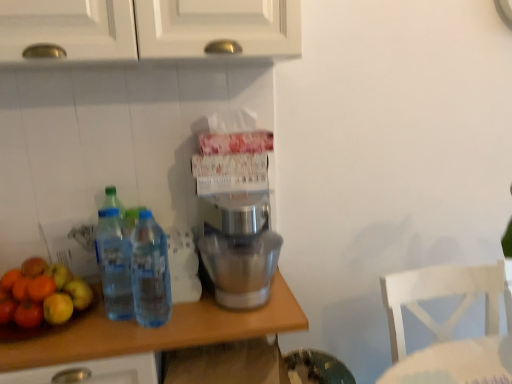
I want to click on white wooden chair at lower right, so click(x=443, y=296).

From a real-world perspective, which object stands above the other?

From a 3D spatial view, transparent plastic bottles at left, the second bottle viewed from the right, is above.

From the picture: Are satin silver mixer at center and transparent plastic bottles at left, the first bottle viewed from the left, far apart?

satin silver mixer at center is actually quite close to transparent plastic bottles at left, the first bottle viewed from the left.

Considering the sizes of objects satin silver mixer at center and transparent plastic bottles at left, the first bottle viewed from the left, in the image provided, who is bigger, satin silver mixer at center or transparent plastic bottles at left, the first bottle viewed from the left,?

satin silver mixer at center is bigger.

Find the location of a particular element. The width and height of the screenshot is (512, 384). the 2nd bottle counting from the left of the satin silver mixer at center is located at coordinates (114, 265).

Is point (73, 301) in front of point (503, 260)?

Yes, it is in front of point (503, 260).

From a real-world perspective, is shiny green apple at left physically located above or below white wooden chair at lower right?

In terms of real-world spatial position, shiny green apple at left is above white wooden chair at lower right.

Locate an element on the screen. Image resolution: width=512 pixels, height=384 pixels. apple behind the white wooden chair at lower right is located at coordinates (41, 294).

Is white wooden chair at lower right surrounded by shiny green apple at left?

Definitely not — white wooden chair at lower right is not inside shiny green apple at left.

Considering the positions of objects clear plastic bottles at center, the first bottle in the right-to-left sequence, and clear wood countertop at center in the image provided, who is more to the right, clear plastic bottles at center, the first bottle in the right-to-left sequence, or clear wood countertop at center?

From the viewer's perspective, clear plastic bottles at center, the first bottle in the right-to-left sequence, appears more on the right side.

From a real-world perspective, is clear plastic bottles at center, arranged as the 2th bottle when viewed from the left, below clear wood countertop at center?

No, from a real-world perspective, clear plastic bottles at center, arranged as the 2th bottle when viewed from the left, is not under clear wood countertop at center.

Is clear wood countertop at center a part of clear plastic bottles at center, the first bottle in the right-to-left sequence?

No, clear plastic bottles at center, the first bottle in the right-to-left sequence, does not contain clear wood countertop at center.

Are clear plastic bottles at center, arranged as the 2th bottle when viewed from the left, and clear wood countertop at center making contact?

No, clear plastic bottles at center, arranged as the 2th bottle when viewed from the left, is not next to clear wood countertop at center.

Which object is positioned more to the left, white wooden chair at lower right or satin silver mixer at center?

From the viewer's perspective, satin silver mixer at center appears more on the left side.

Can you confirm if white wooden chair at lower right is wider than satin silver mixer at center?

Indeed, white wooden chair at lower right has a greater width compared to satin silver mixer at center.

Looking at this image, considering the sizes of objects white wooden chair at lower right and satin silver mixer at center in the image provided, who is taller, white wooden chair at lower right or satin silver mixer at center?

Standing taller between the two is white wooden chair at lower right.

From a real-world perspective, between white wooden chair at lower right and satin silver mixer at center, who is vertically higher?

From a 3D spatial view, satin silver mixer at center is above.

Which of these two, satin silver mixer at center or shiny green apple at left, is bigger?

With larger size is satin silver mixer at center.

How much distance is there between satin silver mixer at center and shiny green apple at left?

satin silver mixer at center is 19.06 inches away from shiny green apple at left.

From the image's perspective, which object appears higher, satin silver mixer at center or shiny green apple at left?

satin silver mixer at center is shown above in the image.

Relative to shiny green apple at left, is satin silver mixer at center in front or behind?

Visually, satin silver mixer at center is located behind shiny green apple at left.

How much distance is there between shiny green apple at left and clear wood countertop at center?

The distance of shiny green apple at left from clear wood countertop at center is 19.70 centimeters.

Does shiny green apple at left have a lesser height compared to clear wood countertop at center?

Yes.

Considering the points (15, 316) and (95, 344), which point is behind, point (15, 316) or point (95, 344)?

Point (15, 316)

Is point (152, 219) closer or farther from the camera than point (206, 250)?

Clearly, point (152, 219) is more distant from the camera than point (206, 250).

Considering the positions of objects clear plastic bottles at center, arranged as the 2th bottle when viewed from the left, and satin silver mixer at center in the image provided, who is in front, clear plastic bottles at center, arranged as the 2th bottle when viewed from the left, or satin silver mixer at center?

clear plastic bottles at center, arranged as the 2th bottle when viewed from the left, is in front.

From a real-world perspective, relative to satin silver mixer at center, is clear plastic bottles at center, the first bottle in the right-to-left sequence, vertically above or below?

Clearly, from a real-world perspective, clear plastic bottles at center, the first bottle in the right-to-left sequence, is above satin silver mixer at center.

Is clear plastic bottles at center, the first bottle in the right-to-left sequence, oriented towards satin silver mixer at center?

No.

This screenshot has height=384, width=512. Find the location of `home appliance that appears below the transparent plastic bottles at left, the first bottle viewed from the left (from a real-world perspective)`. home appliance that appears below the transparent plastic bottles at left, the first bottle viewed from the left (from a real-world perspective) is located at coordinates (237, 209).

In the image, there is a shiny green apple at left. Where is `chair below it (from the image's perspective)`? Image resolution: width=512 pixels, height=384 pixels. chair below it (from the image's perspective) is located at coordinates (443, 296).

Estimate the real-world distances between objects in this image. Which object is closer to clear plastic bottles at center, the first bottle in the right-to-left sequence, transparent plastic bottles at left, the first bottle viewed from the left, or satin silver mixer at center?

The object closer to clear plastic bottles at center, the first bottle in the right-to-left sequence, is transparent plastic bottles at left, the first bottle viewed from the left.

Based on the photo, from the image, which object appears to be nearer to white wooden chair at lower right, satin silver mixer at center or transparent plastic bottles at left, the first bottle viewed from the left?

Among the two, satin silver mixer at center is located nearer to white wooden chair at lower right.

From the image, which object appears to be farther from shiny green apple at left, clear wood countertop at center or clear plastic bottles at center, arranged as the 2th bottle when viewed from the left?

clear plastic bottles at center, arranged as the 2th bottle when viewed from the left, is positioned further to the anchor shiny green apple at left.

From the image, which object appears to be farther from clear plastic bottles at center, arranged as the 2th bottle when viewed from the left, satin silver mixer at center or clear wood countertop at center?

satin silver mixer at center.

Which object lies further to the anchor point shiny green apple at left, clear wood countertop at center or white wooden chair at lower right?

Among the two, white wooden chair at lower right is located further to shiny green apple at left.

When comparing their distances from clear wood countertop at center, does shiny green apple at left or white wooden chair at lower right seem further?

white wooden chair at lower right is positioned further to the anchor clear wood countertop at center.

Based on their spatial positions, is shiny green apple at left or transparent plastic bottles at left, the first bottle viewed from the left, closer to satin silver mixer at center?

The object closer to satin silver mixer at center is transparent plastic bottles at left, the first bottle viewed from the left.

Which object lies nearer to the anchor point satin silver mixer at center, clear plastic bottles at center, arranged as the 2th bottle when viewed from the left, or white wooden chair at lower right?

clear plastic bottles at center, arranged as the 2th bottle when viewed from the left, is closer to satin silver mixer at center.

Find the location of `countertop between shiny green apple at left and satin silver mixer at center from left to right`. countertop between shiny green apple at left and satin silver mixer at center from left to right is located at coordinates (157, 331).

What are the coordinates of `bottle between transparent plastic bottles at left, the first bottle viewed from the left, and white wooden chair at lower right, in the horizontal direction` in the screenshot? It's located at (150, 272).

Find the location of `bottle between transparent plastic bottles at left, the first bottle viewed from the left, and clear wood countertop at center in the up-down direction`. bottle between transparent plastic bottles at left, the first bottle viewed from the left, and clear wood countertop at center in the up-down direction is located at coordinates (150, 272).

Identify the location of bottle located between transparent plastic bottles at left, the first bottle viewed from the left, and satin silver mixer at center in the left-right direction. (150, 272).